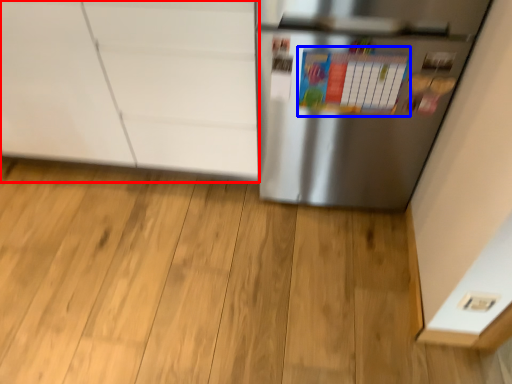
Question: Which of the following is the farthest to the observer, cabinetry (highlighted by a red box) or bulletin board (highlighted by a blue box)?

Choices:
 (A) cabinetry
 (B) bulletin board

Answer: (A)